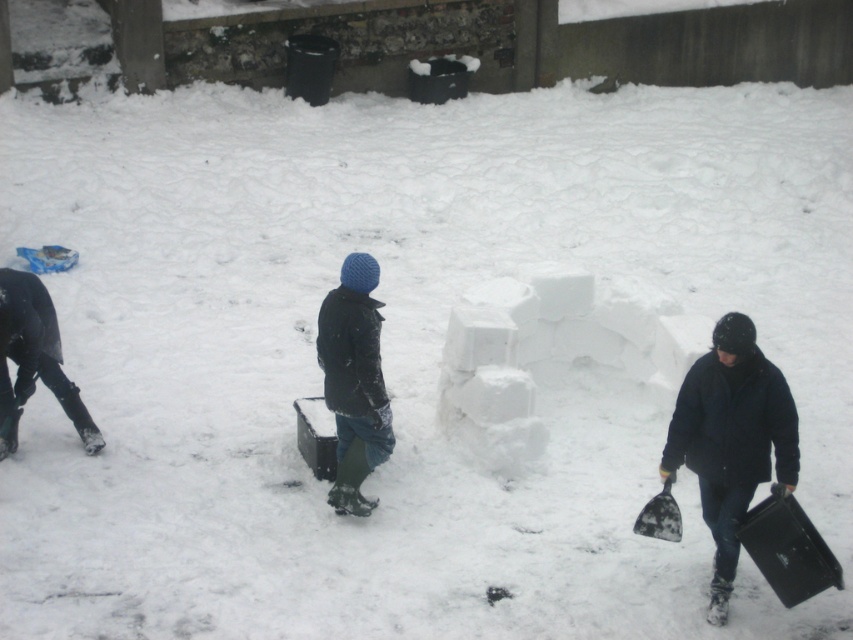
You are a snowplow operator with a vehicle that is 4 meters wide. You need to clear a path between the black matte pants at lower left and the black plastic shovel at lower right. Can your vehicle fit through the space between them?

The distance between the black matte pants at lower left and the black plastic shovel at lower right is 4.07 meters, so yes, the snowplow vehicle can fit through the space since it is slightly wider than the vehicle.

You are standing at the center of the snowy area and need to move towards the dark blue jacket at lower right and the black matte pants at lower left. Which direction should you walk to reach the narrower of the two first?

The dark blue jacket at lower right is narrower than the black matte pants at lower left. Since you want to reach the narrower one first, you should walk towards the dark blue jacket at lower right.